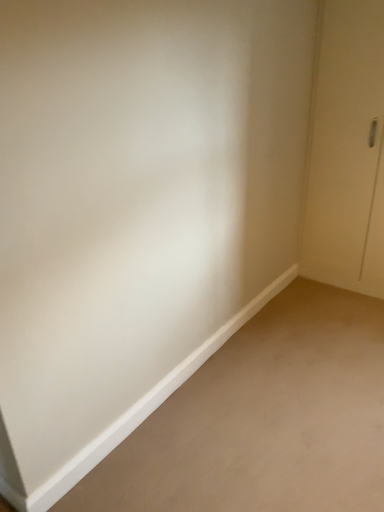
Question: From the image's perspective, is white matte door at right positioned above or below white matte baseboard at lower left?

Choices:
 (A) below
 (B) above

Answer: (B)

Question: Considering the positions of white matte door at right and white matte baseboard at lower left in the image, is white matte door at right taller or shorter than white matte baseboard at lower left?

Choices:
 (A) short
 (B) tall

Answer: (B)

Question: Looking at the image, does white matte door at right seem bigger or smaller compared to white matte baseboard at lower left?

Choices:
 (A) small
 (B) big

Answer: (B)

Question: Choose the correct answer: Is white matte baseboard at lower left inside white matte door at right or outside it?

Choices:
 (A) inside
 (B) outside

Answer: (B)

Question: Considering the positions of point (380, 431) and point (347, 84), is point (380, 431) closer or farther from the camera than point (347, 84)?

Choices:
 (A) closer
 (B) farther

Answer: (A)

Question: From a real-world perspective, is white matte baseboard at lower left positioned above or below white matte door at right?

Choices:
 (A) above
 (B) below

Answer: (B)

Question: From the image's perspective, is white matte baseboard at lower left located above or below white matte door at right?

Choices:
 (A) below
 (B) above

Answer: (A)